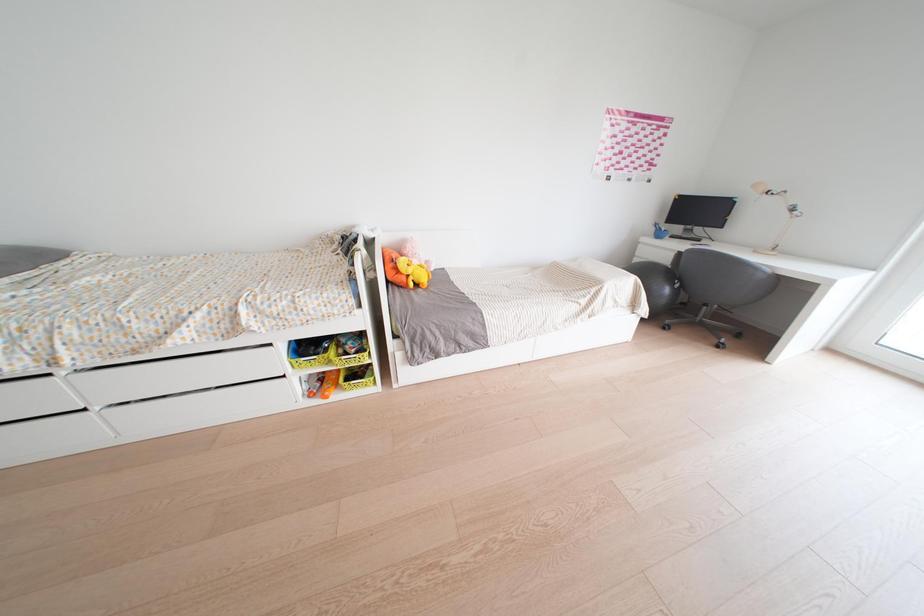
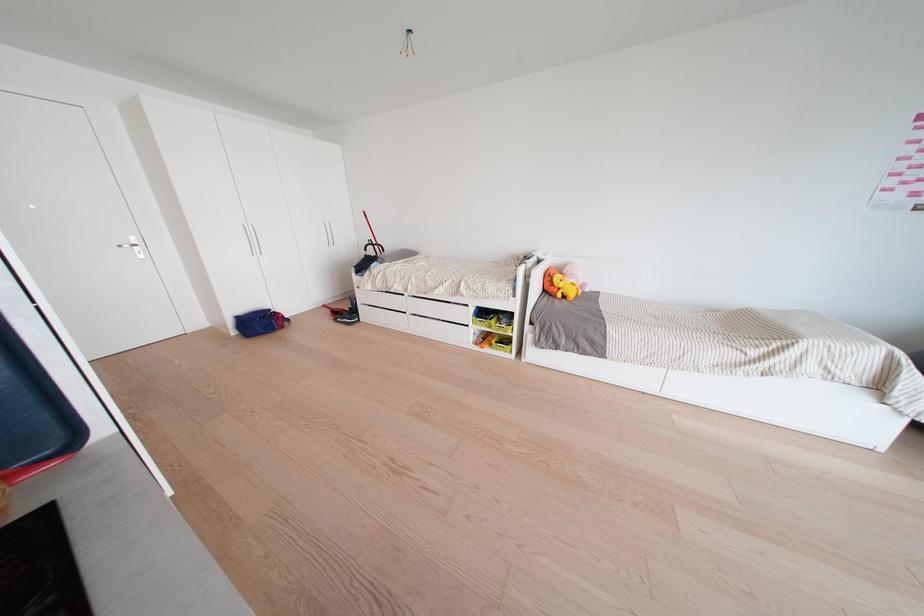
Question: The camera is either moving clockwise (left) or counter-clockwise (right) around the object. The first image is from the beginning of the video and the second image is from the end. Is the camera moving left or right when shooting the video?

Choices:
 (A) Left
 (B) Right

Answer: (B)